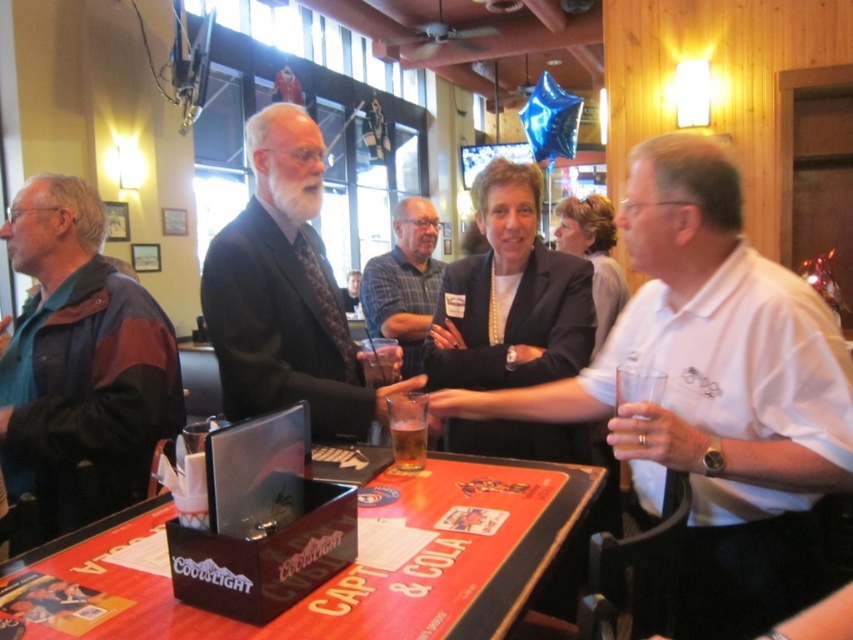
Consider the image. You are a customer at the bar and want to grab both the teal leather jacket at left and the plaid shirt at center. Which item should you reach for first to avoid blocking the other?

The teal leather jacket at left should be reached for first since it is positioned to the left of the plaid shirt at center, so grabbing it first would prevent blocking the shirt.